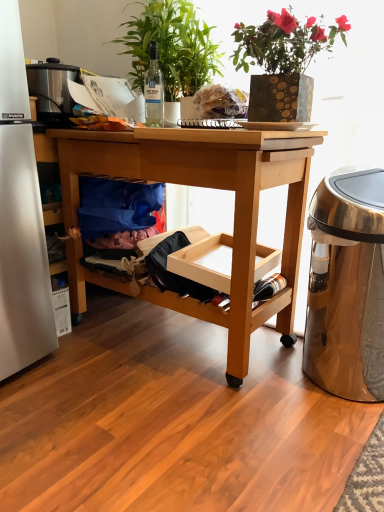
Measure the distance between translucent glass bottle at lower right, which is the second bottle from top to bottom, and camera.

A distance of 1.61 meters exists between translucent glass bottle at lower right, which is the second bottle from top to bottom, and camera.

What do you see at coordinates (268, 287) in the screenshot? The height and width of the screenshot is (512, 384). I see `translucent glass bottle at lower right, the first bottle when ordered from bottom to top` at bounding box center [268, 287].

Locate an element on the screen. blue fabric bag at lower left is located at coordinates (117, 211).

Looking at this image, measure the distance between point [163,86] and camera.

Point [163,86] and camera are 1.71 meters apart.

Image resolution: width=384 pixels, height=512 pixels. I want to click on green leafy plant at upper center, which is counted as the 1th houseplant, starting from the left, so click(171, 47).

The width and height of the screenshot is (384, 512). Identify the location of gold-patterned pot at upper center, the second houseplant in the left-to-right sequence. point(283,62).

At what (x,y) coordinates should I click in order to perform the action: click on translucent glass bottle at lower right, the first bottle when ordered from bottom to top. Please return your answer as a coordinate pair (x, y). This screenshot has width=384, height=512. Looking at the image, I should click on (268, 287).

Considering the sizes of shiny metallic trash can at right and blue fabric bag at lower left in the image, is shiny metallic trash can at right taller or shorter than blue fabric bag at lower left?

Considering their sizes, shiny metallic trash can at right has more height than blue fabric bag at lower left.

Can we say shiny metallic trash can at right lies outside blue fabric bag at lower left?

shiny metallic trash can at right lies outside blue fabric bag at lower left's area.

Considering the points (381, 274) and (132, 187), which point is in front, point (381, 274) or point (132, 187)?

Positioned in front is point (381, 274).

Is shiny metallic trash can at right not inside translucent glass bottle at lower right, the first bottle in the right-to-left sequence?

That's correct, shiny metallic trash can at right is outside of translucent glass bottle at lower right, the first bottle in the right-to-left sequence.

From the image's perspective, is shiny metallic trash can at right located above or below translucent glass bottle at lower right, the first bottle when ordered from bottom to top?

shiny metallic trash can at right is situated higher than translucent glass bottle at lower right, the first bottle when ordered from bottom to top, in the image.

Can you confirm if shiny metallic trash can at right is positioned to the left of translucent glass bottle at lower right, which is the second bottle from top to bottom?

In fact, shiny metallic trash can at right is to the right of translucent glass bottle at lower right, which is the second bottle from top to bottom.

Which point is more forward, (305, 31) or (317, 322)?

Point (305, 31)

Does gold-patterned pot at upper center, the 1th houseplant from the right, turn towards shiny metallic trash can at right?

No, gold-patterned pot at upper center, the 1th houseplant from the right, is not aimed at shiny metallic trash can at right.

From the image's perspective, which is above, gold-patterned pot at upper center, the second houseplant in the left-to-right sequence, or shiny metallic trash can at right?

gold-patterned pot at upper center, the second houseplant in the left-to-right sequence, is shown above in the image.

Starting from the clear glass bottle at center, the second bottle when ordered from right to left, which houseplant is the 1st one in front? Please provide its 2D coordinates.

[(171, 47)]

Are green leafy plant at upper center, which is counted as the 1th houseplant, starting from the left, and clear glass bottle at center, the first bottle in the top-to-bottom sequence, located far from each other?

green leafy plant at upper center, which is counted as the 1th houseplant, starting from the left, is actually quite close to clear glass bottle at center, the first bottle in the top-to-bottom sequence.

Consider the image. Is green leafy plant at upper center, which is counted as the 1th houseplant, starting from the left, to the right of clear glass bottle at center, which is the second bottle from bottom to top, from the viewer's perspective?

Correct, you'll find green leafy plant at upper center, which is counted as the 1th houseplant, starting from the left, to the right of clear glass bottle at center, which is the second bottle from bottom to top.

Considering the sizes of objects gold-patterned pot at upper center, the 1th houseplant from the right, and natural wood desk at center in the image provided, who is smaller, gold-patterned pot at upper center, the 1th houseplant from the right, or natural wood desk at center?

gold-patterned pot at upper center, the 1th houseplant from the right.

Which is nearer, [232,59] or [249,170]?

Point [232,59] is farther from the camera than point [249,170].

Which object is closer to the camera, gold-patterned pot at upper center, the second houseplant in the left-to-right sequence, or natural wood desk at center?

Answer: gold-patterned pot at upper center, the second houseplant in the left-to-right sequence, is in front.

From a real-world perspective, is gold-patterned pot at upper center, the second houseplant in the left-to-right sequence, above or below natural wood desk at center?

gold-patterned pot at upper center, the second houseplant in the left-to-right sequence, is above natural wood desk at center.

From a real-world perspective, is gold-patterned pot at upper center, the second houseplant in the left-to-right sequence, located higher than green leafy plant at upper center, which is counted as the 1th houseplant, starting from the left?

Incorrect, from a real-world perspective, gold-patterned pot at upper center, the second houseplant in the left-to-right sequence, is lower than green leafy plant at upper center, which is counted as the 1th houseplant, starting from the left.

In the scene shown: What's the angular difference between gold-patterned pot at upper center, the second houseplant in the left-to-right sequence, and green leafy plant at upper center, the second houseplant in the right-to-left sequence,'s facing directions?

They differ by 0.312 degrees in their facing directions.

Who is taller, gold-patterned pot at upper center, the second houseplant in the left-to-right sequence, or green leafy plant at upper center, which is counted as the 1th houseplant, starting from the left?

green leafy plant at upper center, which is counted as the 1th houseplant, starting from the left, is taller.

In the scene shown: Could you tell me if gold-patterned pot at upper center, the second houseplant in the left-to-right sequence, is facing green leafy plant at upper center, the second houseplant in the right-to-left sequence?

No, gold-patterned pot at upper center, the second houseplant in the left-to-right sequence, is not aimed at green leafy plant at upper center, the second houseplant in the right-to-left sequence.

Does natural wood desk at center have a greater height compared to gold-patterned pot at upper center, the 1th houseplant from the right?

Yes, natural wood desk at center is taller than gold-patterned pot at upper center, the 1th houseplant from the right.

The image size is (384, 512). In the image, there is a gold-patterned pot at upper center, the 1th houseplant from the right. Identify the location of desk below it (from the image's perspective). (214, 188).

Is point (77, 298) positioned behind point (256, 111)?

Yes, it is.

The width and height of the screenshot is (384, 512). Identify the location of trash bin/can on the right of blue fabric bag at lower left. (347, 285).

Where is `bottle below the shiny metallic trash can at right (from a real-world perspective)`? The height and width of the screenshot is (512, 384). bottle below the shiny metallic trash can at right (from a real-world perspective) is located at coordinates (268, 287).

Looking at the image, which one is located further to gold-patterned pot at upper center, the 1th houseplant from the right, natural wood desk at center or translucent glass bottle at lower right, the first bottle when ordered from bottom to top?

translucent glass bottle at lower right, the first bottle when ordered from bottom to top, is positioned further to the anchor gold-patterned pot at upper center, the 1th houseplant from the right.

Estimate the real-world distances between objects in this image. Which object is further from blue fabric bag at lower left, shiny metallic trash can at right or green leafy plant at upper center, which is counted as the 1th houseplant, starting from the left?

shiny metallic trash can at right is further to blue fabric bag at lower left.

From the image, which object appears to be nearer to blue fabric bag at lower left, green leafy plant at upper center, the second houseplant in the right-to-left sequence, or gold-patterned pot at upper center, the second houseplant in the left-to-right sequence?

Based on the image, green leafy plant at upper center, the second houseplant in the right-to-left sequence, appears to be nearer to blue fabric bag at lower left.

Looking at the image, which one is located closer to clear glass bottle at center, the first bottle in the top-to-bottom sequence, translucent glass bottle at lower right, the first bottle when ordered from bottom to top, or shiny metallic trash can at right?

translucent glass bottle at lower right, the first bottle when ordered from bottom to top, lies closer to clear glass bottle at center, the first bottle in the top-to-bottom sequence, than the other object.

Based on their spatial positions, is green leafy plant at upper center, which is counted as the 1th houseplant, starting from the left, or shiny metallic trash can at right further from translucent glass bottle at lower right, which ranks as the 2th bottle in left-to-right order?

green leafy plant at upper center, which is counted as the 1th houseplant, starting from the left, is positioned further to the anchor translucent glass bottle at lower right, which ranks as the 2th bottle in left-to-right order.

From the image, which object appears to be nearer to blue fabric bag at lower left, shiny metallic trash can at right or natural wood desk at center?

Among the two, natural wood desk at center is located nearer to blue fabric bag at lower left.

Based on their spatial positions, is blue fabric bag at lower left or natural wood desk at center closer to clear glass bottle at center, the first bottle in the top-to-bottom sequence?

blue fabric bag at lower left lies closer to clear glass bottle at center, the first bottle in the top-to-bottom sequence, than the other object.

From the image, which object appears to be nearer to shiny metallic trash can at right, gold-patterned pot at upper center, the 1th houseplant from the right, or green leafy plant at upper center, the second houseplant in the right-to-left sequence?

gold-patterned pot at upper center, the 1th houseplant from the right.

Locate an element on the screen. This screenshot has height=512, width=384. desk between blue fabric bag at lower left and gold-patterned pot at upper center, the second houseplant in the left-to-right sequence, in the horizontal direction is located at coordinates (214, 188).

Locate an element on the screen. houseplant that lies between clear glass bottle at center, which is the first bottle from left to right, and natural wood desk at center from top to bottom is located at coordinates (283, 62).

Where is `houseplant between clear glass bottle at center, the second bottle when ordered from right to left, and translucent glass bottle at lower right, the first bottle when ordered from bottom to top, in the vertical direction`? The width and height of the screenshot is (384, 512). houseplant between clear glass bottle at center, the second bottle when ordered from right to left, and translucent glass bottle at lower right, the first bottle when ordered from bottom to top, in the vertical direction is located at coordinates (283, 62).

Locate an element on the screen. The width and height of the screenshot is (384, 512). houseplant between green leafy plant at upper center, the second houseplant in the right-to-left sequence, and shiny metallic trash can at right from top to bottom is located at coordinates (283, 62).